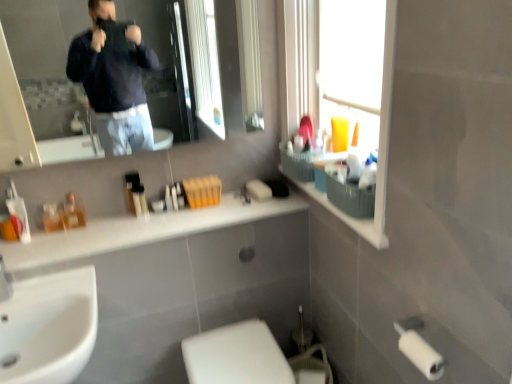
Where is `vacant space that is in between translucent plastic bottles at left, which appears as the 1th toiletry when viewed from the left, and translucent plastic tubes at center, which is counted as the 1th toiletry, starting from the right`? vacant space that is in between translucent plastic bottles at left, which appears as the 1th toiletry when viewed from the left, and translucent plastic tubes at center, which is counted as the 1th toiletry, starting from the right is located at coordinates (110, 220).